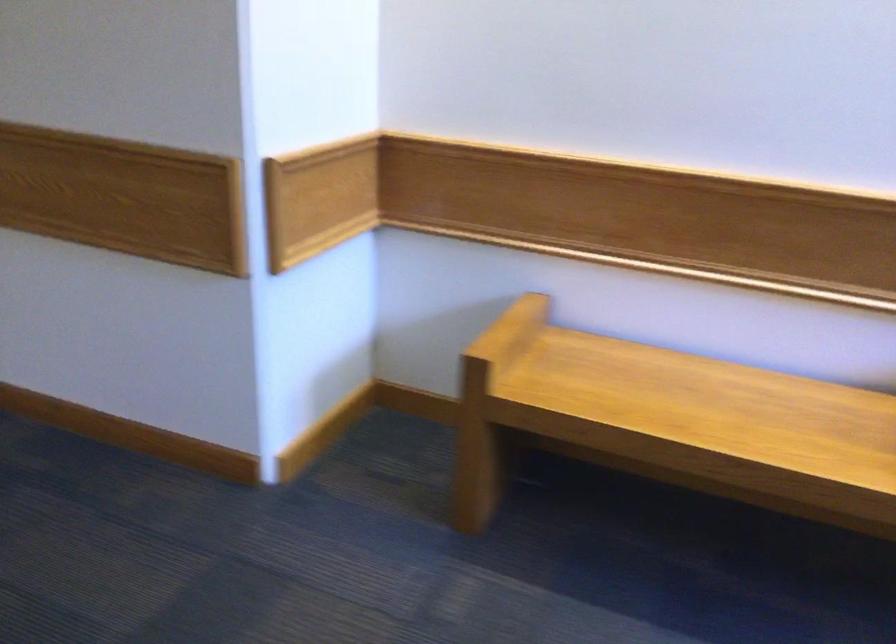
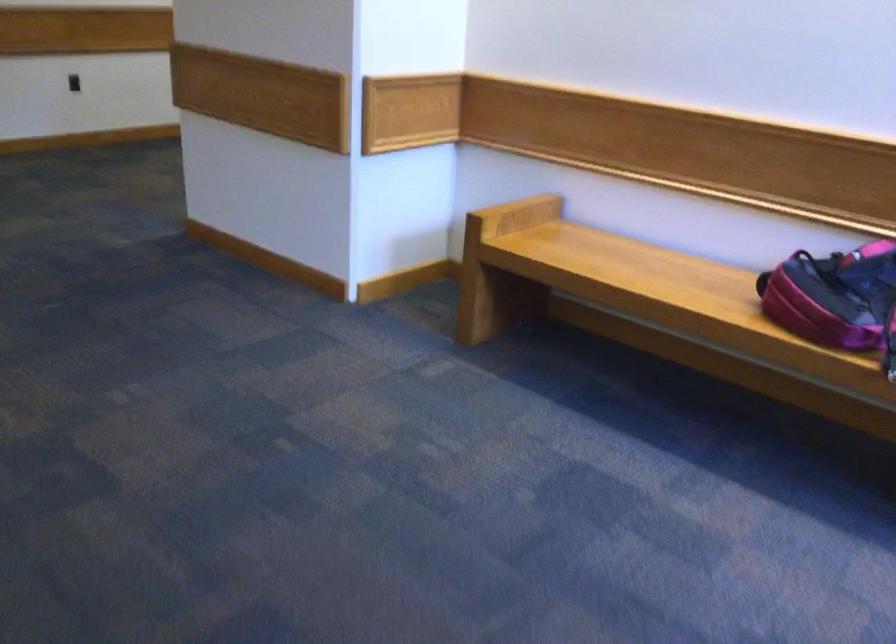
Locate, in the second image, the point that corresponds to point 712,411 in the first image.

(633, 270)